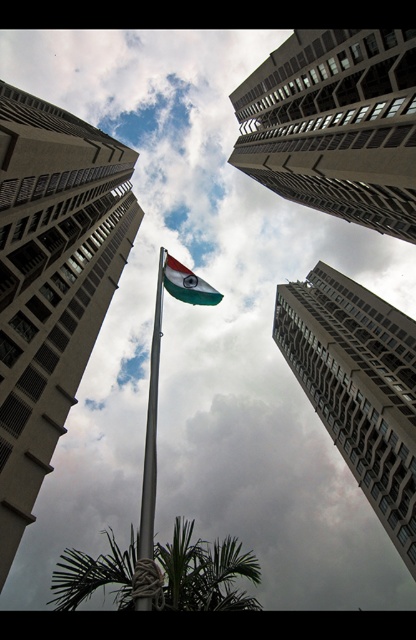
Question: Considering the real-world distances, which object is farthest from the concrete building at center?

Choices:
 (A) metallic pole at center
 (B) gray concrete building at upper center

Answer: (B)

Question: Does concrete building at center appear under gray concrete building at center?

Choices:
 (A) yes
 (B) no

Answer: (B)

Question: Which of the following is the closest to the observer?

Choices:
 (A) concrete building at center
 (B) tricolor fabric flag at center
 (C) metallic pole at center

Answer: (C)

Question: Is gray concrete building at upper center bigger than metallic pole at center?

Choices:
 (A) yes
 (B) no

Answer: (A)

Question: Does concrete building at center have a lesser width compared to gray concrete building at center?

Choices:
 (A) yes
 (B) no

Answer: (B)

Question: Which object is farther from the camera taking this photo?

Choices:
 (A) gray concrete building at upper center
 (B) tricolor fabric flag at center
 (C) gray concrete building at center

Answer: (C)